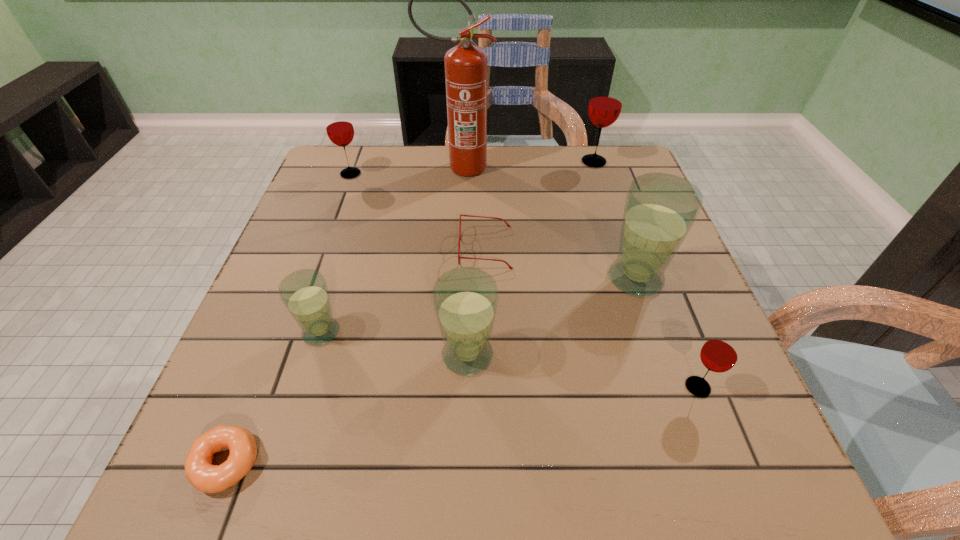
You are a GUI agent. You are given a task and a screenshot of the screen. Output one action in this format:
    pyautogui.click(x=<x>, y=<y>)
    Task: Click on the free space between the leftmost red glass and the red fire extinguisher
    The image size is (960, 540).
    Given the screenshot: What is the action you would take?
    pyautogui.click(x=404, y=171)

Identify the location of blank region between the second shortest object and the tan doughnut. (356, 356).

At what (x,y) coordinates should I click in order to perform the action: click on free spot between the farthest blue glass and the leftmost red glass. Please return your answer as a coordinate pair (x, y). The height and width of the screenshot is (540, 960). Looking at the image, I should click on (493, 226).

Locate an element on the screen. This screenshot has width=960, height=540. blank region between the leftmost red glass and the leftmost blue glass is located at coordinates (336, 253).

Locate which object ranks second in proximity to the leftmost blue glass. Please provide its 2D coordinates. Your answer should be formatted as a tuple, i.e. [(x, y)], where the tuple contains the x and y coordinates of a point satisfying the conditions above.

[(465, 299)]

The height and width of the screenshot is (540, 960). I want to click on object that stands as the fifth closest to the red fire extinguisher, so click(x=304, y=293).

The height and width of the screenshot is (540, 960). I want to click on the fourth closest glass to the second smallest red glass, so click(x=660, y=209).

In order to click on the second closest glass to the second blue glass from left to right in this screenshot , I will do `click(660, 209)`.

Locate which red glass ranks third in proximity to the biggest blue glass. Please provide its 2D coordinates. Your answer should be formatted as a tuple, i.e. [(x, y)], where the tuple contains the x and y coordinates of a point satisfying the conditions above.

[(339, 127)]

Identify the location of red glass that can be found as the second closest to the leftmost blue glass. The height and width of the screenshot is (540, 960). (721, 351).